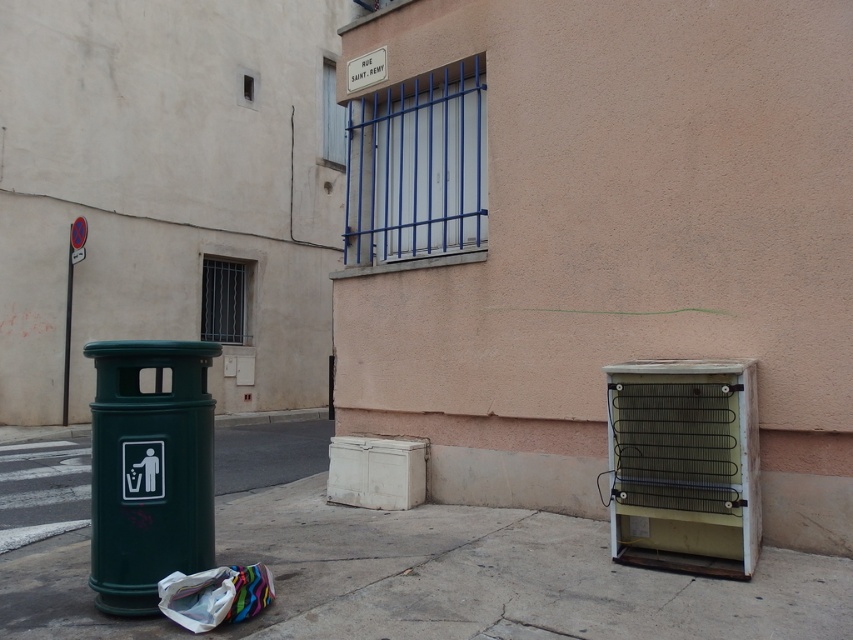
Question: Does concrete at lower center appear on the right side of green plastic trash can at left?

Choices:
 (A) yes
 (B) no

Answer: (A)

Question: Is concrete at lower center below green plastic trash can at left?

Choices:
 (A) no
 (B) yes

Answer: (B)

Question: Which of the following is the closest to the observer?

Choices:
 (A) green plastic trash can at left
 (B) concrete at lower center

Answer: (A)

Question: Among these points, which one is nearest to the camera?

Choices:
 (A) (688, 624)
 (B) (167, 392)

Answer: (A)

Question: Is concrete at lower center bigger than green plastic trash can at left?

Choices:
 (A) no
 (B) yes

Answer: (A)

Question: Among these objects, which one is nearest to the camera?

Choices:
 (A) concrete at lower center
 (B) green plastic trash can at left

Answer: (B)